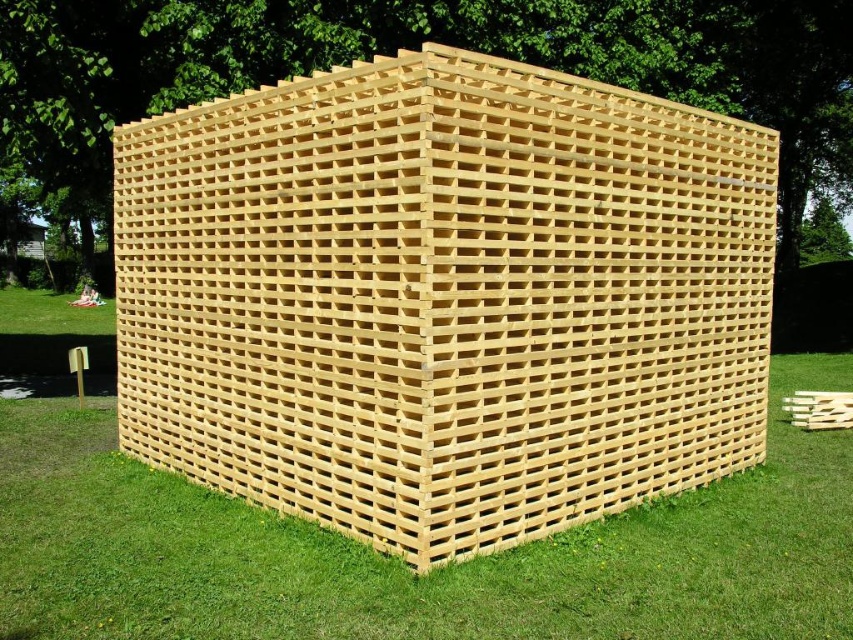
Question: Is natural wood lattice structure at center further to the viewer compared to green grass at lower center?

Choices:
 (A) yes
 (B) no

Answer: (A)

Question: Can you confirm if natural wood lattice structure at center is bigger than green grass at lower center?

Choices:
 (A) no
 (B) yes

Answer: (B)

Question: Among these points, which one is farthest from the camera?

Choices:
 (A) (775, 444)
 (B) (583, 497)

Answer: (A)

Question: Does natural wood lattice structure at center have a greater width compared to green grass at lower center?

Choices:
 (A) yes
 (B) no

Answer: (B)

Question: Among these points, which one is farthest from the camera?

Choices:
 (A) (376, 144)
 (B) (109, 449)

Answer: (B)